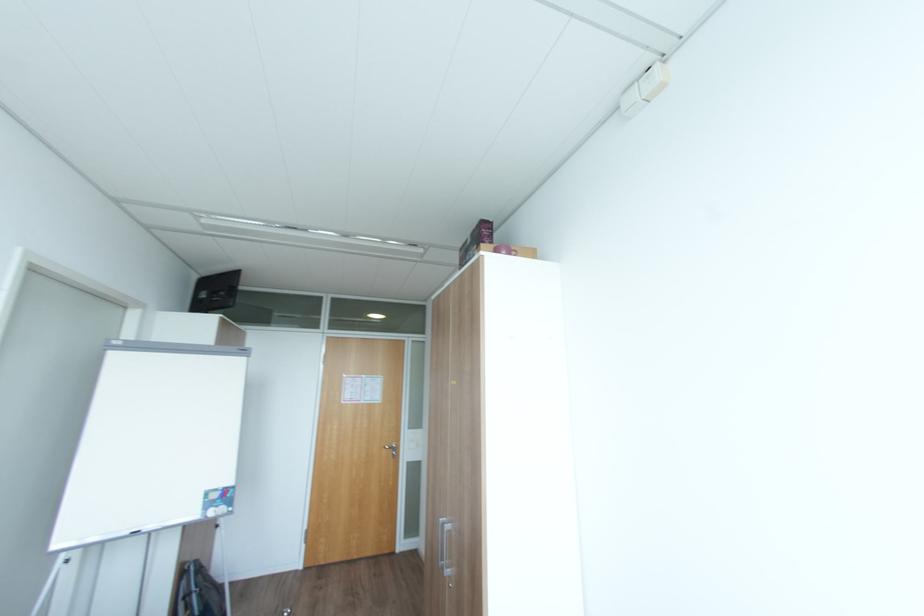
Find the location of a particular element. Image resolution: width=924 pixels, height=616 pixels. silver door handle is located at coordinates (392, 448).